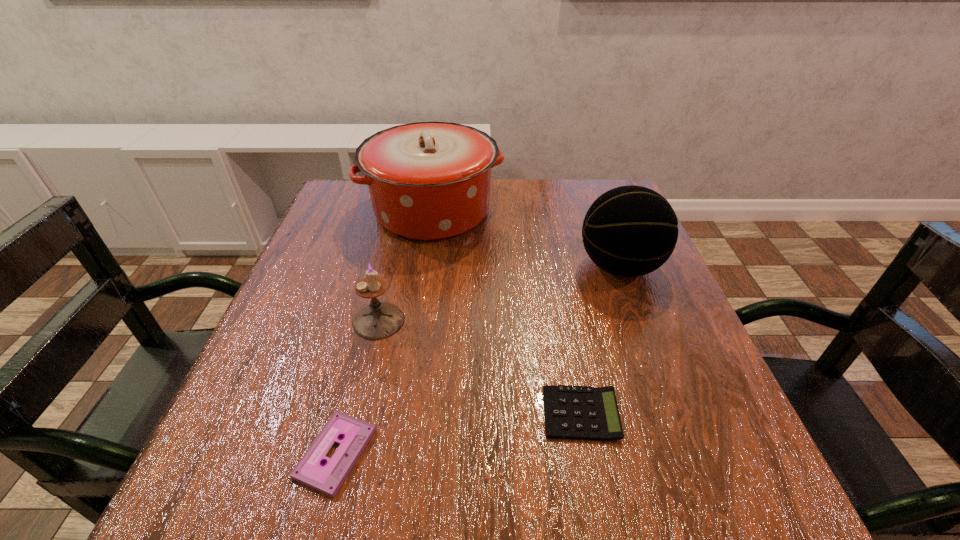
Where is `free space at the left edge of the desktop`? free space at the left edge of the desktop is located at coordinates (292, 426).

Find the location of a particular element. The width and height of the screenshot is (960, 540). vacant space at the right edge of the desktop is located at coordinates (654, 293).

This screenshot has height=540, width=960. In order to click on free space at the far left corner in this screenshot , I will do `click(348, 189)`.

The width and height of the screenshot is (960, 540). I want to click on free space between the videotape and the third tallest object, so click(x=357, y=387).

This screenshot has width=960, height=540. Identify the location of free space between the videotape and the basketball. (478, 360).

This screenshot has width=960, height=540. I want to click on blank region between the third farthest object and the casserole, so (405, 266).

Where is `empty space between the shortest object and the basketball`? empty space between the shortest object and the basketball is located at coordinates (478, 360).

The image size is (960, 540). I want to click on vacant space that is in between the third farthest object and the second shortest object, so click(480, 367).

Where is `vacant region between the casserole and the fourth tallest object`? The width and height of the screenshot is (960, 540). vacant region between the casserole and the fourth tallest object is located at coordinates (507, 312).

I want to click on empty space that is in between the calculator and the basketball, so click(600, 340).